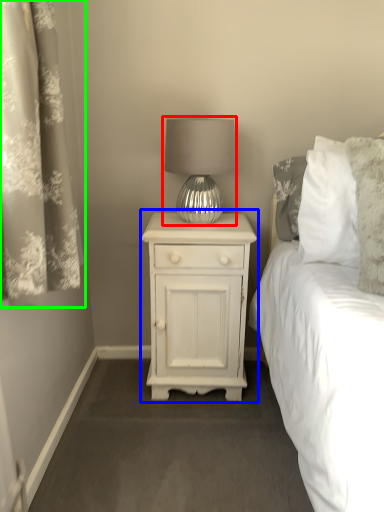
Question: Which object is the farthest from lamp (highlighted by a red box)? Choose among these: nightstand (highlighted by a blue box) or curtain (highlighted by a green box).

Choices:
 (A) nightstand
 (B) curtain

Answer: (B)